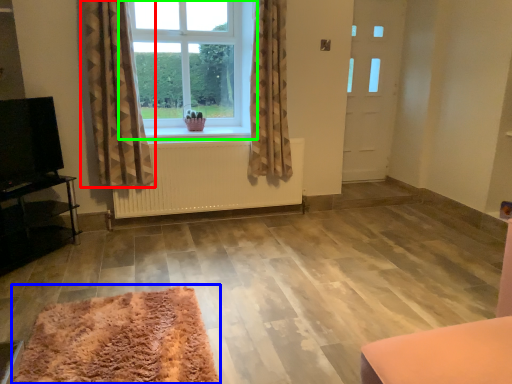
Question: Which is farther away from curtain (highlighted by a red box)? mat (highlighted by a blue box) or window (highlighted by a green box)?

Choices:
 (A) mat
 (B) window

Answer: (A)